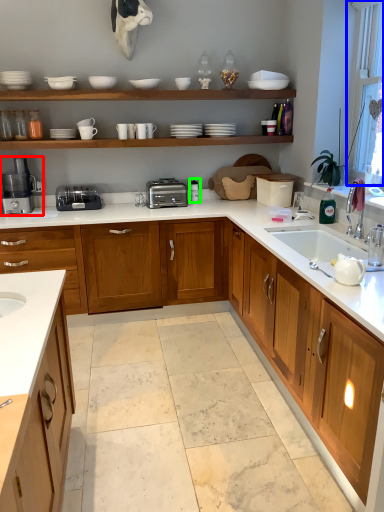
Question: Considering the real-world distances, which object is closest to coffee machine (highlighted by a red box)? window screen (highlighted by a blue box) or appliance (highlighted by a green box).

Choices:
 (A) window screen
 (B) appliance

Answer: (B)